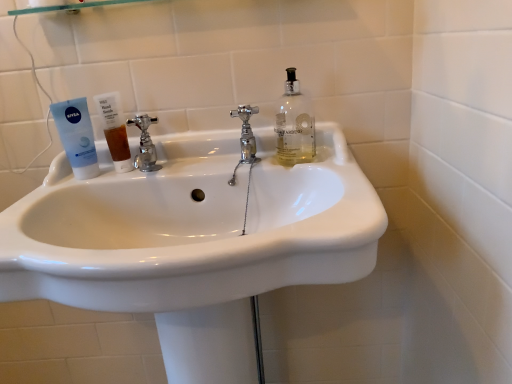
Question: From the image's perspective, relative to white glossy sink at center, is brown translucent liquid at sink left above or below?

Choices:
 (A) above
 (B) below

Answer: (A)

Question: In terms of size, does brown translucent liquid at sink left appear bigger or smaller than white glossy sink at center?

Choices:
 (A) big
 (B) small

Answer: (B)

Question: Which object is the farthest from the polished chrome faucet at center, the 2th tap in the right-to-left sequence?

Choices:
 (A) brown translucent liquid at sink left
 (B) blue matte tube at left
 (C) polished chrome faucet at center, arranged as the 1th tap when viewed from the right
 (D) white glossy sink at center

Answer: (D)

Question: Which object is positioned farthest from the polished chrome faucet at center, arranged as the 1th tap when viewed from the right?

Choices:
 (A) polished chrome faucet at center, the 2th tap in the right-to-left sequence
 (B) white glossy sink at center
 (C) brown translucent liquid at sink left
 (D) blue matte tube at left

Answer: (D)